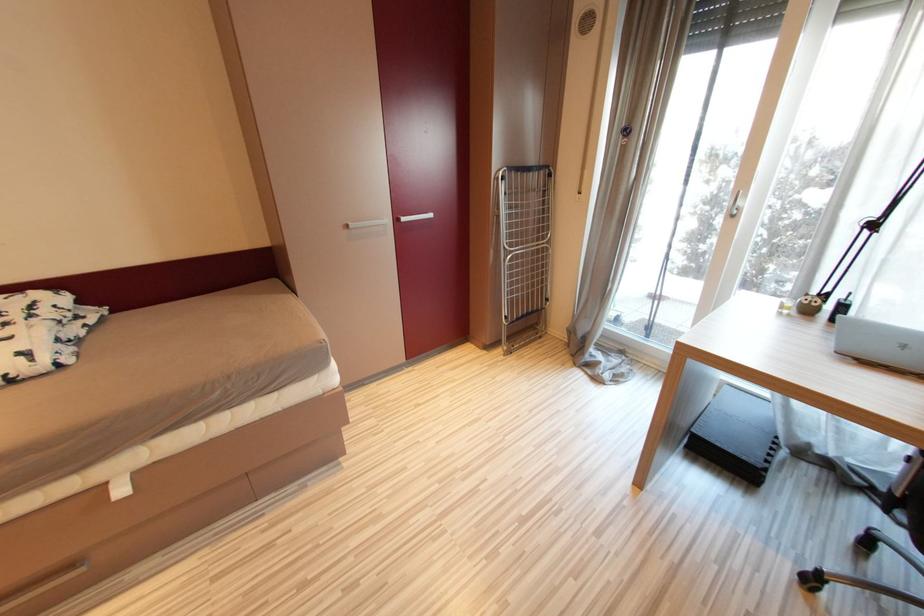
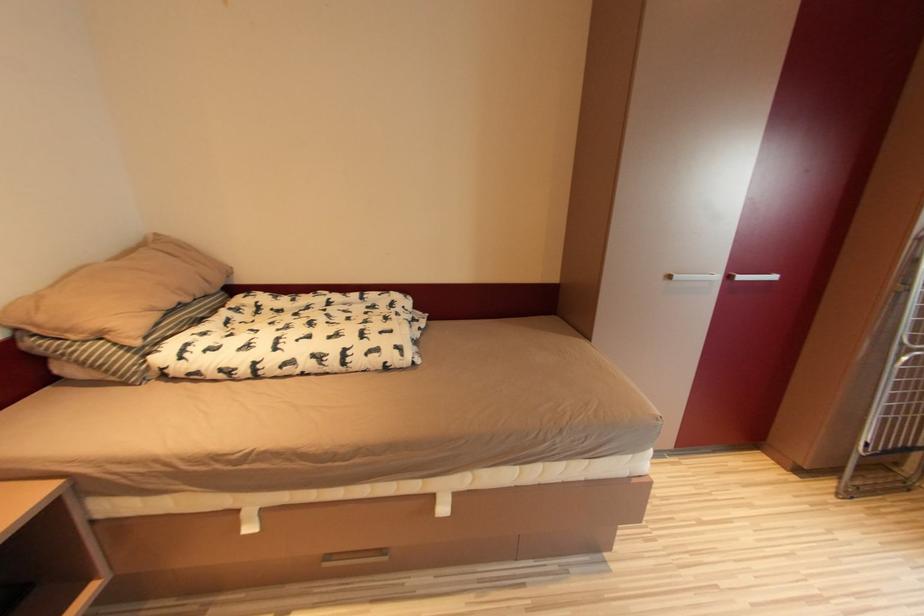
Question: Based on the continuous images, in which direction is the camera rotating? Reply with the corresponding letter.

Choices:
 (A) Left
 (B) Right
 (C) Up
 (D) Down

Answer: (A)